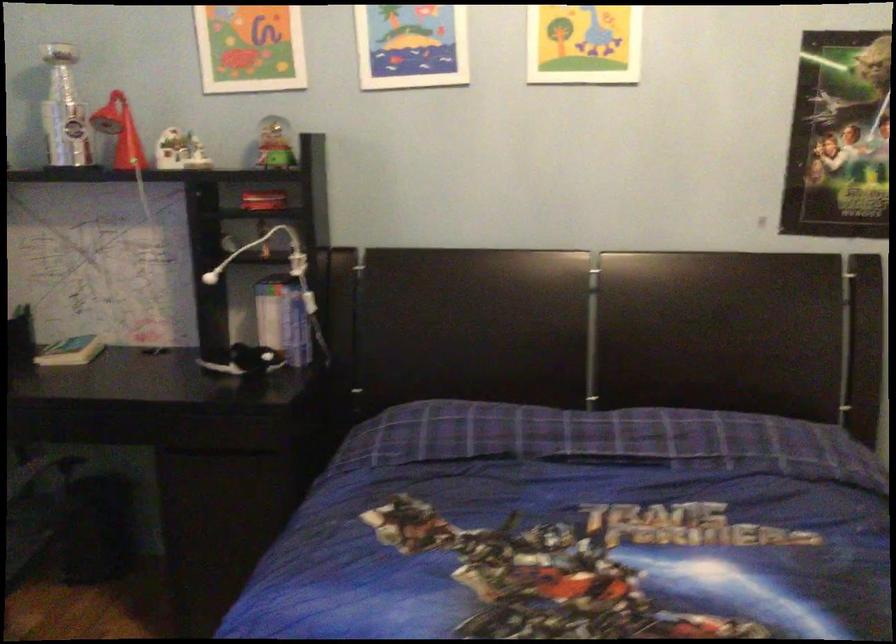
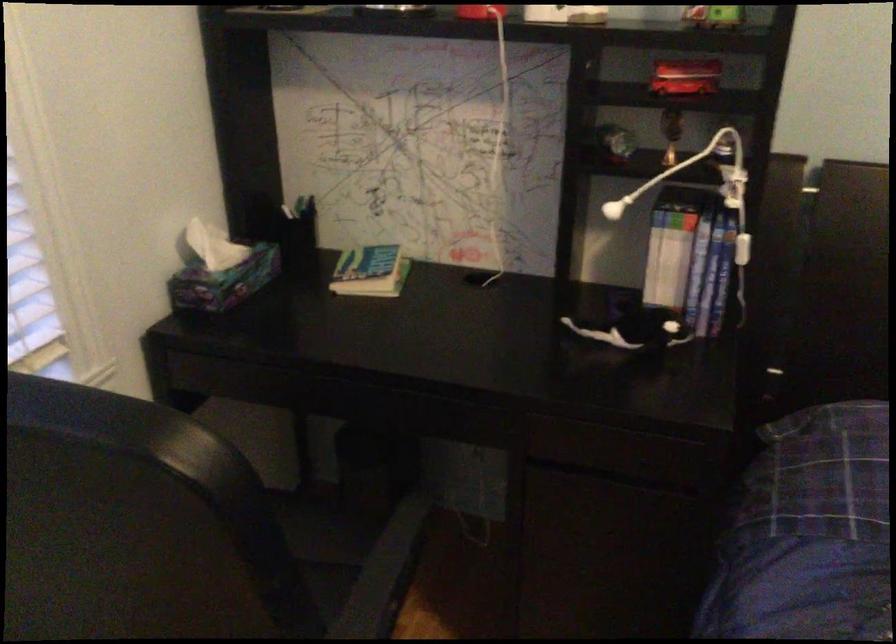
Locate, in the second image, the point that corresponds to pixel 311 299 in the first image.

(742, 249)